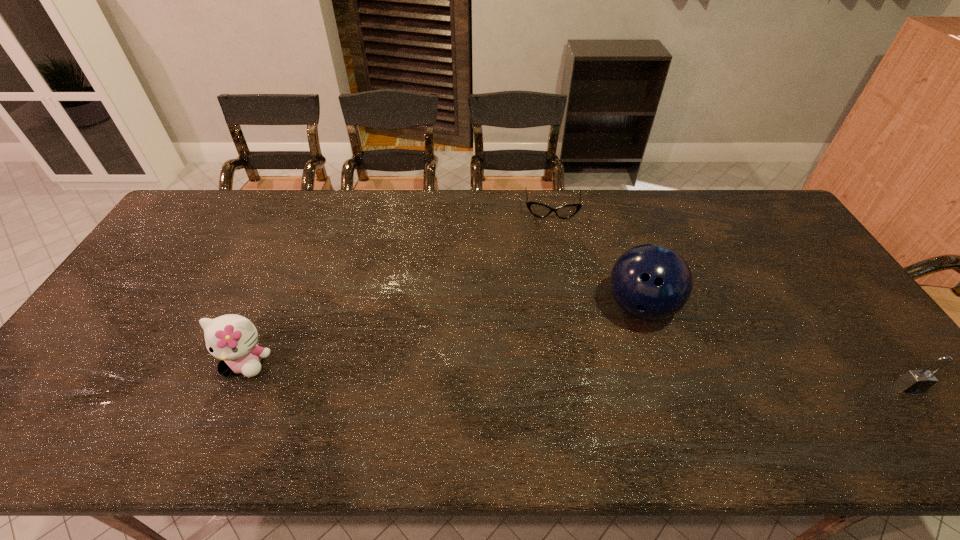
You are a GUI agent. You are given a task and a screenshot of the screen. Output one action in this format:
    pyautogui.click(x=<x>, y=<y>)
    Task: Click on the free space on the desktop that is between the second tallest object and the padlock and is positioned on the surface of the tallest object near the finger holes
    
    Given the screenshot: What is the action you would take?
    pyautogui.click(x=649, y=377)

Locate an element on the screen. This screenshot has height=540, width=960. vacant spot on the desktop that is between the kitten and the rightmost object and is positioned on the front-facing side of the shortest object is located at coordinates (560, 374).